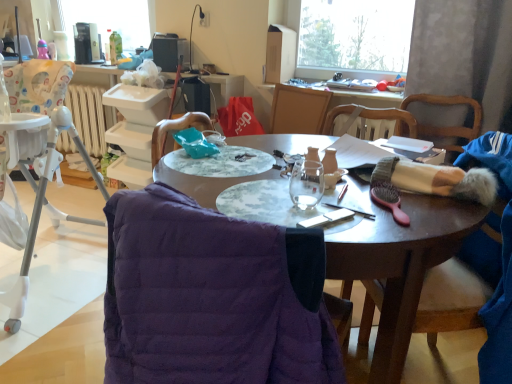
Question: From a real-world perspective, is metallic black lamp at upper center physically below white plastic radiator at left?

Choices:
 (A) yes
 (B) no

Answer: (B)

Question: Does metallic black lamp at upper center have a smaller size compared to white plastic radiator at left?

Choices:
 (A) yes
 (B) no

Answer: (A)

Question: Is metallic black lamp at upper center shorter than white plastic radiator at left?

Choices:
 (A) yes
 (B) no

Answer: (A)

Question: Is metallic black lamp at upper center to the right of white plastic radiator at left from the viewer's perspective?

Choices:
 (A) yes
 (B) no

Answer: (A)

Question: Does metallic black lamp at upper center come in front of white plastic radiator at left?

Choices:
 (A) yes
 (B) no

Answer: (A)

Question: Can you confirm if metallic black lamp at upper center is thinner than white plastic radiator at left?

Choices:
 (A) no
 (B) yes

Answer: (A)

Question: Is metallic black lamp at upper center shorter than silver metallic phone at center?

Choices:
 (A) no
 (B) yes

Answer: (A)

Question: From the image's perspective, is metallic black lamp at upper center on top of silver metallic phone at center?

Choices:
 (A) yes
 (B) no

Answer: (A)

Question: Is metallic black lamp at upper center not inside silver metallic phone at center?

Choices:
 (A) no
 (B) yes

Answer: (B)

Question: Is metallic black lamp at upper center oriented away from silver metallic phone at center?

Choices:
 (A) no
 (B) yes

Answer: (A)

Question: Considering the relative positions of metallic black lamp at upper center and silver metallic phone at center in the image provided, is metallic black lamp at upper center behind silver metallic phone at center?

Choices:
 (A) no
 (B) yes

Answer: (B)

Question: From a real-world perspective, does metallic black lamp at upper center stand above silver metallic phone at center?

Choices:
 (A) yes
 (B) no

Answer: (A)

Question: Is white plastic radiator at left oriented towards matte purple jacket at lower left?

Choices:
 (A) yes
 (B) no

Answer: (B)